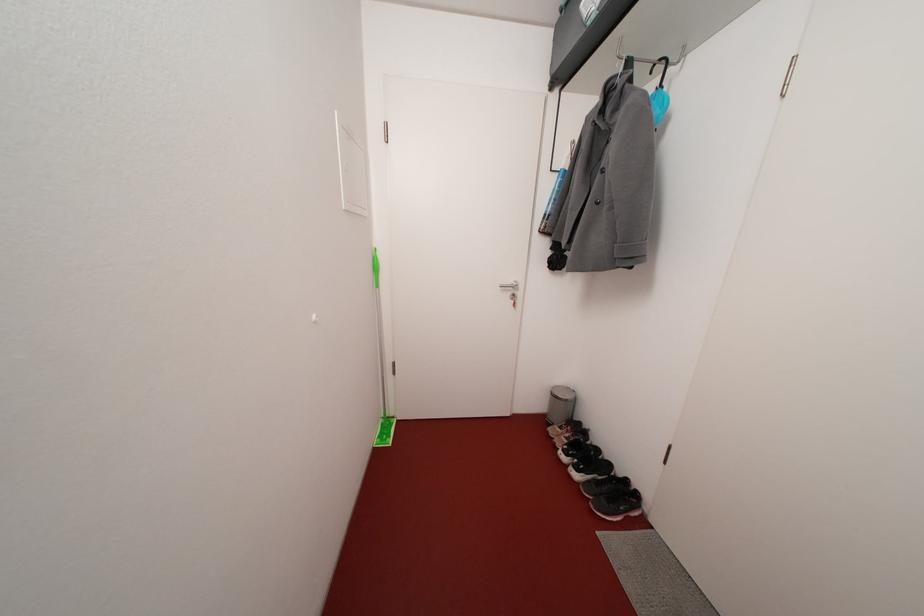
Find where to wear the light colored shoe. Please return your answer as a coordinate pair (x, y).

(612, 496)